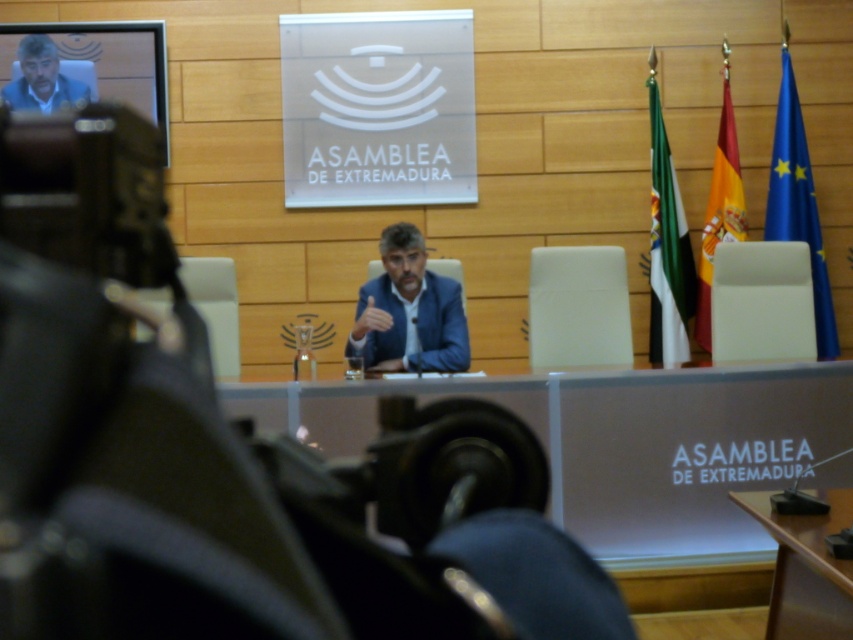
You are standing at the entrance of the Asamblea de Extremadura and want to approach the blue fabric suit at center and the matte blue suit at upper left. Which one is closer to you?

The blue fabric suit at center is closer to you since it is only 2.45 meters away from the matte blue suit at upper left, but without knowing your exact position, it is difficult to determine the exact distance. However, based on the given information, the blue fabric suit at center is nearer to the matte blue suit at upper left than the other way around.

You are attending a meeting in the Asamblea de Extremadura and need to sit down. There is a blue fabric suit at center and a wooden table at center. Which object should you approach if you want to sit?

You should approach the wooden table at center because the blue fabric suit at center is to the left of it, indicating the table is where you can sit.

You are an event organizer planning to seat guests at the wooden table at center. Considering the blue fabric suit at center is worn by a guest, will the suit interfere with the seating arrangement due to its size?

The blue fabric suit at center has a larger width than the wooden table at center, so it may interfere with the seating arrangement as it could take up more space than available at the table.